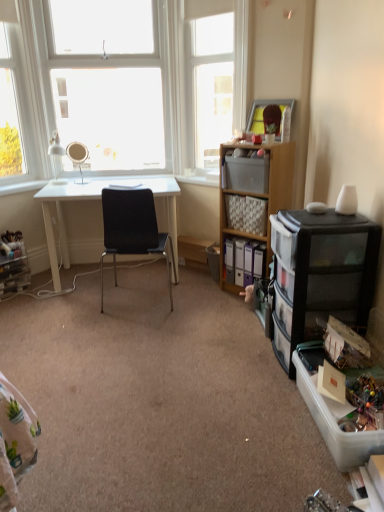
This screenshot has width=384, height=512. I want to click on free space in front of black mesh chair at center, so click(x=122, y=339).